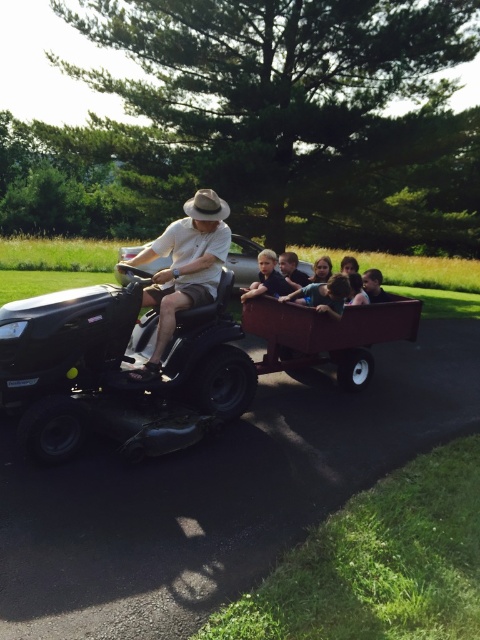
You are a person standing at the edge of the road. You see two shirts, the matte white shirt at center and the matte black shirt at center. Which shirt is closer to you?

The matte white shirt at center is taller than the matte black shirt at center, so the matte white shirt at center is closer to you.

You are standing on the grassy area next to the paved road and see the matte white shirt at center and the smooth wooden wagon at center. Which object is closer to your left side?

The matte white shirt at center is positioned on the left side of the smooth wooden wagon at center, so it is closer to your left side.